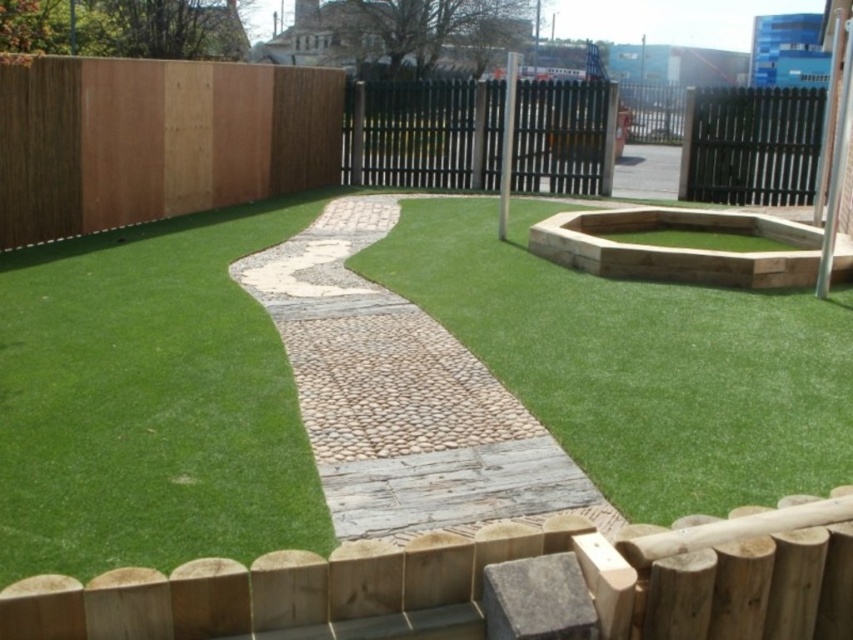
Question: Does green artificial turf at left appear under black metal fence at center?

Choices:
 (A) yes
 (B) no

Answer: (A)

Question: Estimate the real-world distances between objects in this image. Which object is farther from the natural stone pathway at center?

Choices:
 (A) green artificial turf at left
 (B) black metal fence at upper right
 (C) black metal fence at center
 (D) green artificial turf at center

Answer: (C)

Question: Is green artificial turf at left closer to camera compared to green artificial turf at center?

Choices:
 (A) no
 (B) yes

Answer: (A)

Question: Does natural stone pathway at center have a smaller size compared to black metal fence at center?

Choices:
 (A) no
 (B) yes

Answer: (B)

Question: Which object is farther from the camera taking this photo?

Choices:
 (A) green artificial turf at left
 (B) natural stone pathway at center

Answer: (A)

Question: Which point appears farthest from the camera in this image?

Choices:
 (A) (585, 109)
 (B) (115, 244)
 (C) (770, 129)
 (D) (624, 410)

Answer: (A)